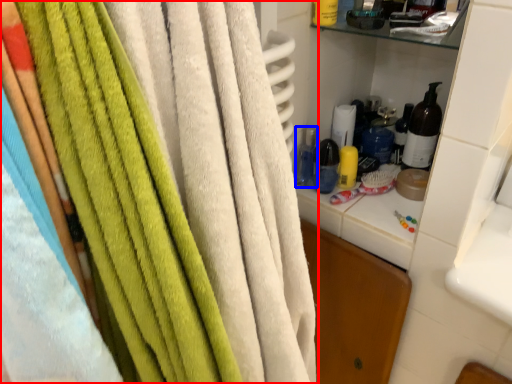
Question: Among these objects, which one is nearest to the camera, towel (highlighted by a red box) or bottle (highlighted by a blue box)?

Choices:
 (A) towel
 (B) bottle

Answer: (A)